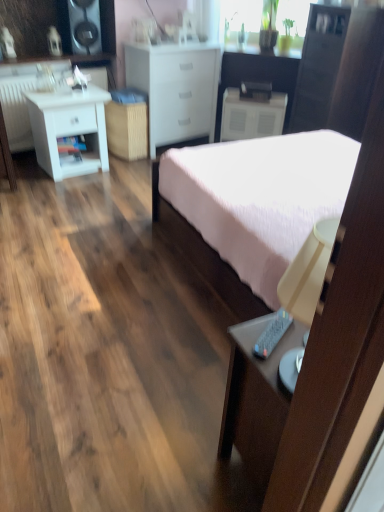
At what (x,y) coordinates should I click in order to perform the action: click on vacant region above white matte nightstand at left, the first nightstand from the left (from a real-world perspective). Please return your answer as a coordinate pair (x, y). The width and height of the screenshot is (384, 512). Looking at the image, I should click on (59, 84).